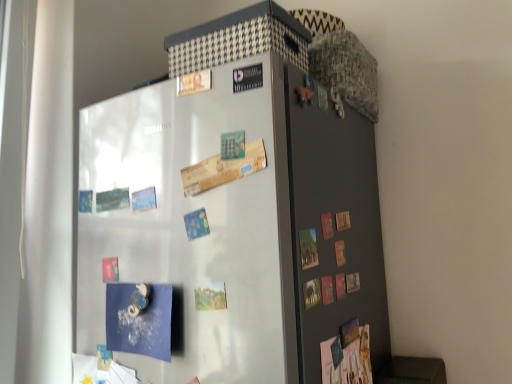
Question: From the image's perspective, relative to matte gray door at right, is satin silver fridge at center above or below?

Choices:
 (A) above
 (B) below

Answer: (B)

Question: From their relative heights in the image, would you say satin silver fridge at center is taller or shorter than matte gray door at right?

Choices:
 (A) short
 (B) tall

Answer: (B)

Question: Considering the positions of point (237, 307) and point (343, 319), is point (237, 307) closer or farther from the camera than point (343, 319)?

Choices:
 (A) closer
 (B) farther

Answer: (A)

Question: Would you say matte gray door at right is to the left or to the right of satin silver fridge at center in the picture?

Choices:
 (A) left
 (B) right

Answer: (B)

Question: From a real-world perspective, is matte gray door at right above or below satin silver fridge at center?

Choices:
 (A) below
 (B) above

Answer: (B)

Question: Is point (337, 205) positioned closer to the camera than point (278, 319)?

Choices:
 (A) farther
 (B) closer

Answer: (A)

Question: Based on their sizes in the image, would you say matte gray door at right is bigger or smaller than satin silver fridge at center?

Choices:
 (A) small
 (B) big

Answer: (A)